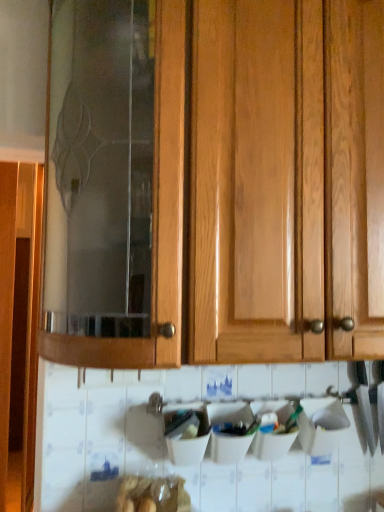
Question: Could you tell me if wooden cabinet at center is turned towards translucent plastic bag at lower center?

Choices:
 (A) yes
 (B) no

Answer: (B)

Question: Can you see wooden cabinet at center touching translucent plastic bag at lower center?

Choices:
 (A) no
 (B) yes

Answer: (A)

Question: Considering the relative positions of wooden cabinet at center and translucent plastic bag at lower center in the image provided, is wooden cabinet at center to the left of translucent plastic bag at lower center from the viewer's perspective?

Choices:
 (A) no
 (B) yes

Answer: (A)

Question: Does wooden cabinet at center have a smaller size compared to translucent plastic bag at lower center?

Choices:
 (A) no
 (B) yes

Answer: (A)

Question: Is wooden cabinet at center taller than translucent plastic bag at lower center?

Choices:
 (A) yes
 (B) no

Answer: (A)

Question: Is wooden cabinet at center shorter than translucent plastic bag at lower center?

Choices:
 (A) no
 (B) yes

Answer: (A)

Question: Does translucent plastic bag at lower center have a greater width compared to wooden cabinet at center?

Choices:
 (A) yes
 (B) no

Answer: (B)

Question: Is wooden cabinet at center at the back of translucent plastic bag at lower center?

Choices:
 (A) no
 (B) yes

Answer: (A)

Question: Is translucent plastic bag at lower center facing towards wooden cabinet at center?

Choices:
 (A) no
 (B) yes

Answer: (A)

Question: From a real-world perspective, is translucent plastic bag at lower center positioned over wooden cabinet at center based on gravity?

Choices:
 (A) yes
 (B) no

Answer: (B)

Question: Can you confirm if translucent plastic bag at lower center is smaller than wooden cabinet at center?

Choices:
 (A) no
 (B) yes

Answer: (B)

Question: Are translucent plastic bag at lower center and wooden cabinet at center located far from each other?

Choices:
 (A) yes
 (B) no

Answer: (B)

Question: From a real-world perspective, relative to wooden cabinet at center, is translucent plastic bag at lower center vertically above or below?

Choices:
 (A) below
 (B) above

Answer: (A)